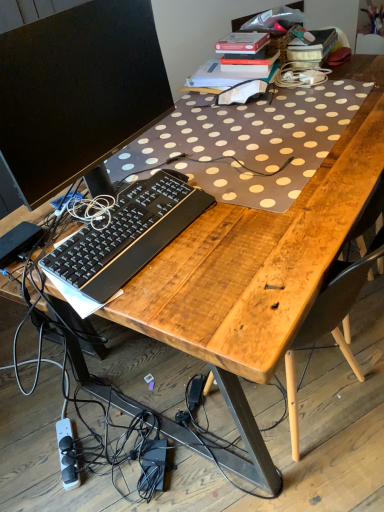
Locate an element on the screen. The width and height of the screenshot is (384, 512). free space in front of white plastic power strip at lower left is located at coordinates (61, 490).